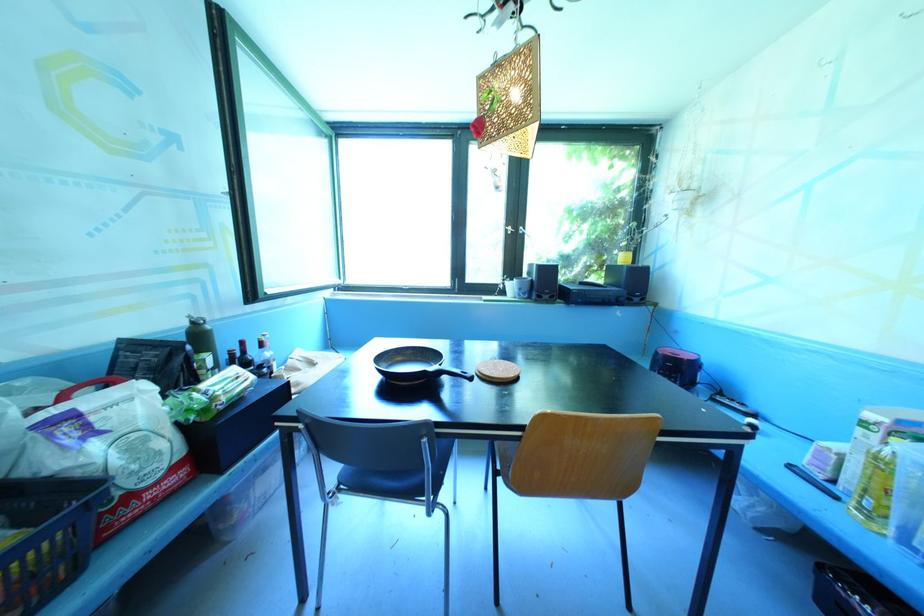
Where is `frying pan handle`? The width and height of the screenshot is (924, 616). frying pan handle is located at coordinates (456, 371).